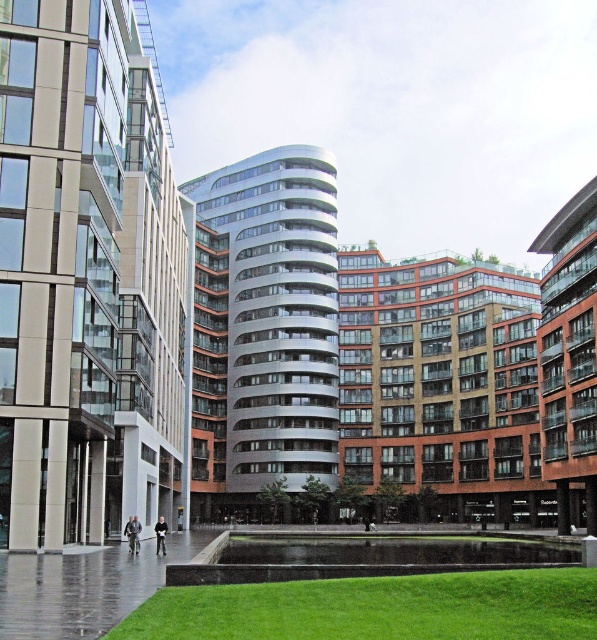
Question: Can you confirm if green grass at lower center is bigger than dark gray jacket at center?

Choices:
 (A) no
 (B) yes

Answer: (A)

Question: Based on their relative distances, which object is farther from the light gray fabric jacket at lower center?

Choices:
 (A) green grass at lower center
 (B) dark gray jacket at center

Answer: (A)

Question: Which point is closer to the camera taking this photo?

Choices:
 (A) (164, 531)
 (B) (527, 573)
 (C) (133, 550)

Answer: (B)

Question: Which point appears farthest from the camera in this image?

Choices:
 (A) (137, 548)
 (B) (456, 621)
 (C) (162, 548)

Answer: (A)

Question: Is light gray fabric jacket at lower center wider than dark gray jacket at center?

Choices:
 (A) no
 (B) yes

Answer: (A)

Question: Is light gray fabric jacket at lower center to the left of dark gray jacket at center from the viewer's perspective?

Choices:
 (A) yes
 (B) no

Answer: (B)